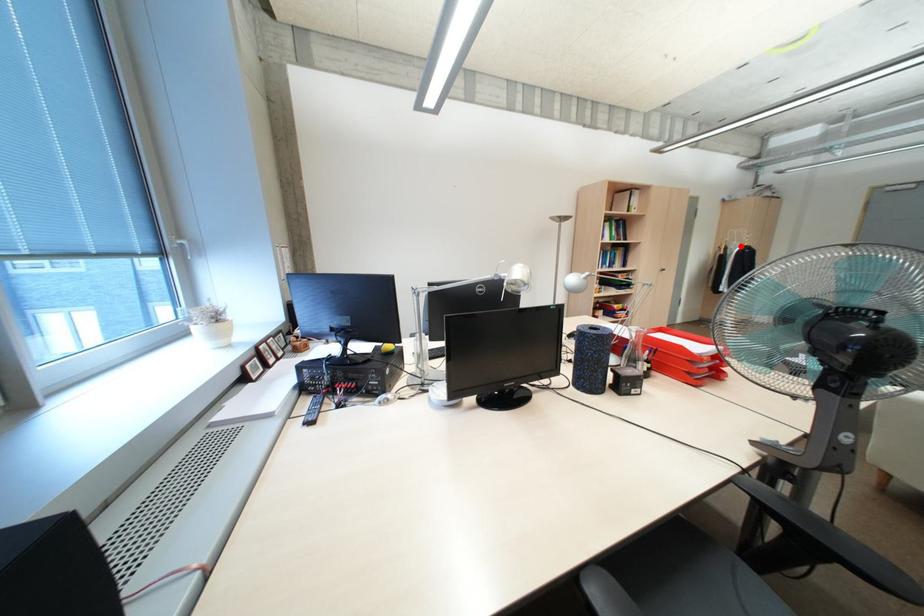
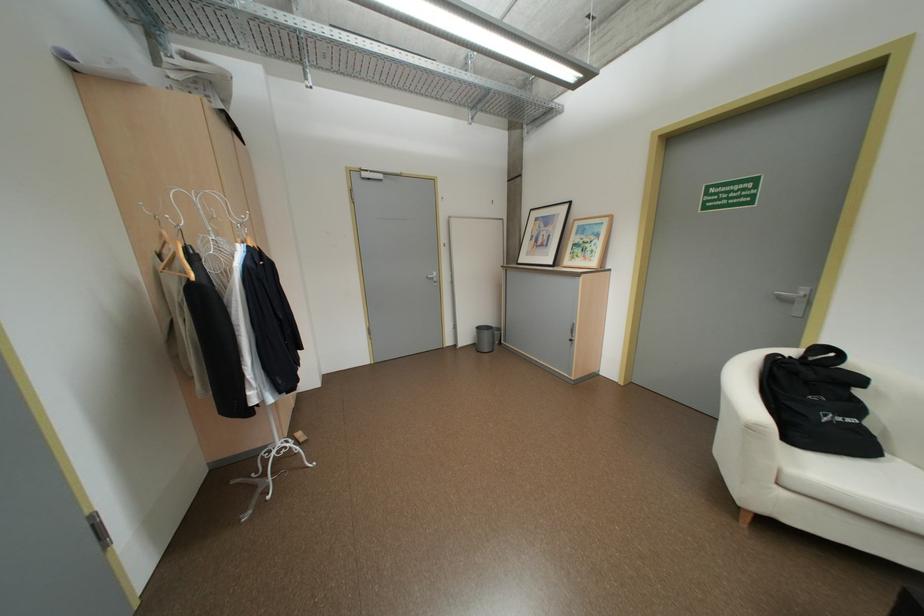
Locate, in the second image, the point that corresponds to the highlighted location in the first image.

(217, 252)